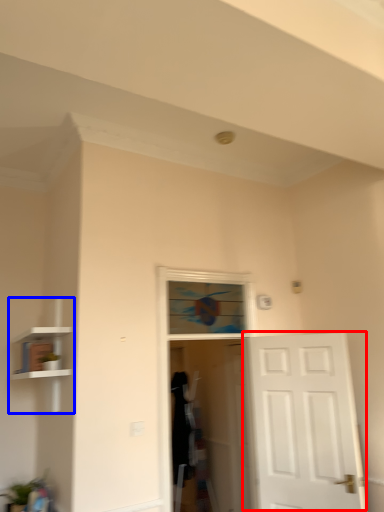
Question: Which point is closer to the camera, door (highlighted by a red box) or bookshelf (highlighted by a blue box)?

Choices:
 (A) door
 (B) bookshelf

Answer: (B)